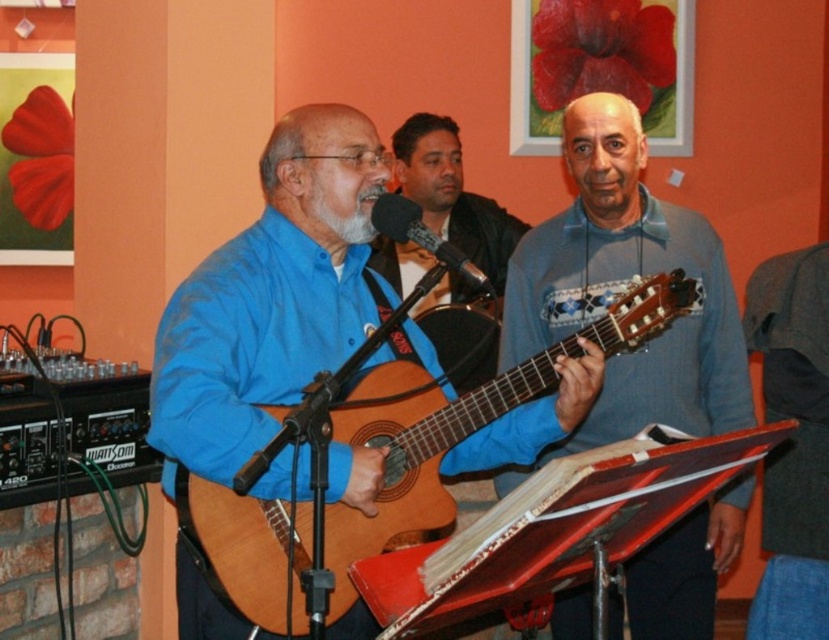
You are a photographer standing at the entrance of the venue. You want to take a photo of the gray cotton sweater at center without moving any objects. Can you capture it in your current position?

The gray cotton sweater at center is 2.52 meters away from viewer, so yes, you can capture it in your current position as it is within a reasonable distance for photography.

You are a stagehand setting up a spotlight for the performer. The spotlight can only be placed at coordinates between 0.7 and 0.8 on the x and y axes. Will the spotlight hit the wooden acoustic guitar at center?

The wooden acoustic guitar at center is located at point [385,468]. The spotlight requires coordinates between 0.7 and 0.8 on both axes. Since the y coordinate 0.466 is below 0.7, the spotlight will not hit the wooden acoustic guitar at center.